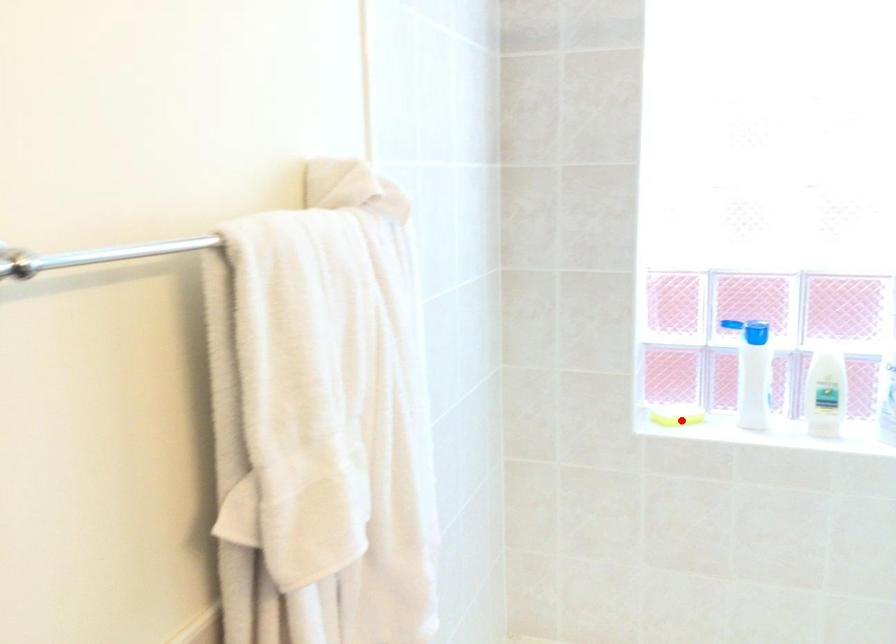
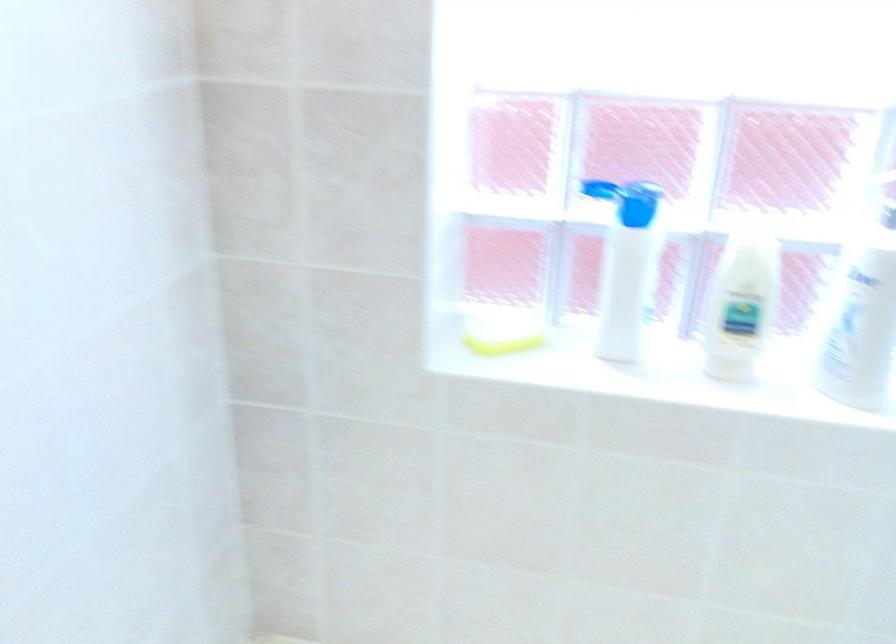
Locate, in the second image, the point that corresponds to the highlighted location in the first image.

(503, 344)